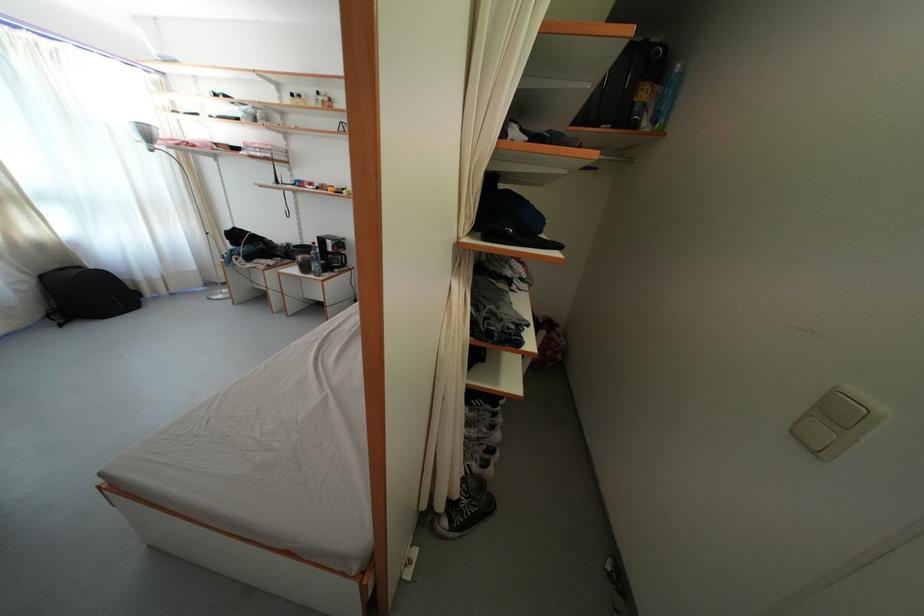
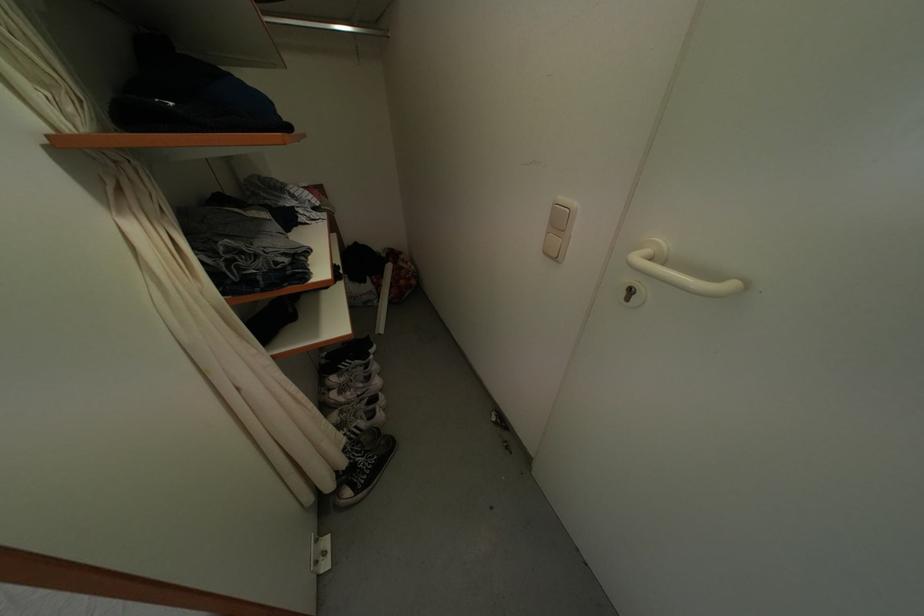
Find the pixel in the second image that matches [478,436] in the first image.

(354, 399)